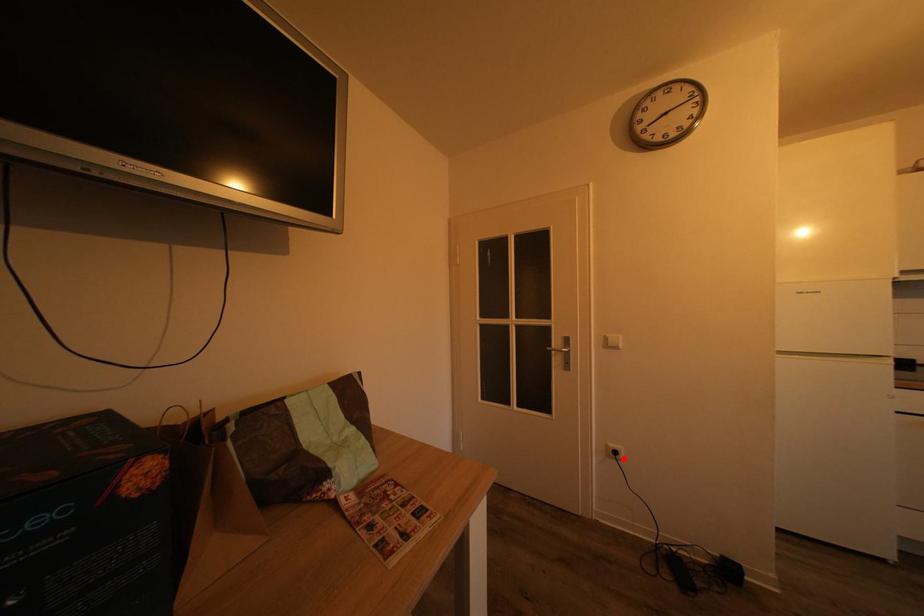
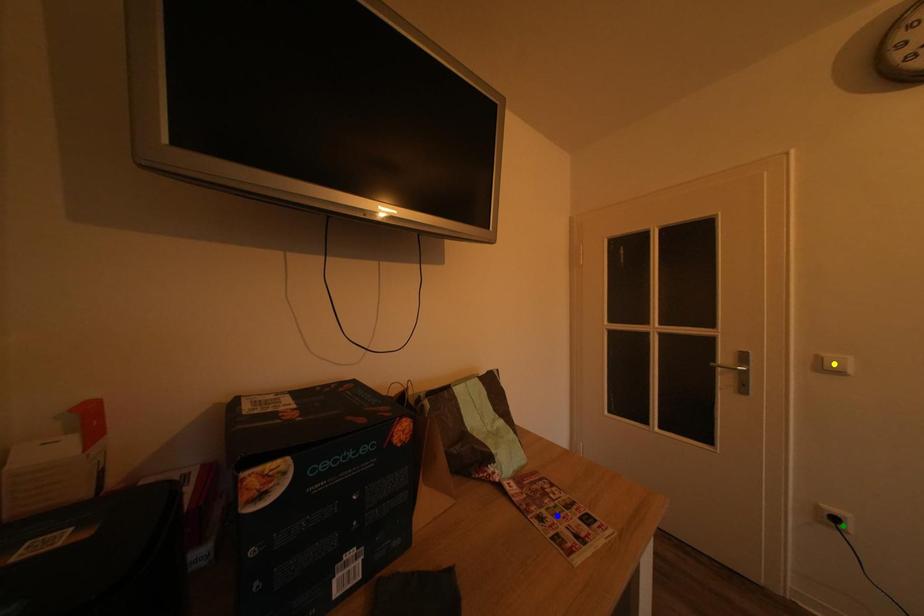
Question: I am providing you with two images of the same scene from different viewpoints. A red point is marked on the first image. You are given multiple points on the second image. Which point in image 2 is actually the same real-world point as the red point in image 1?

Choices:
 (A) green point
 (B) yellow point
 (C) blue point

Answer: (A)